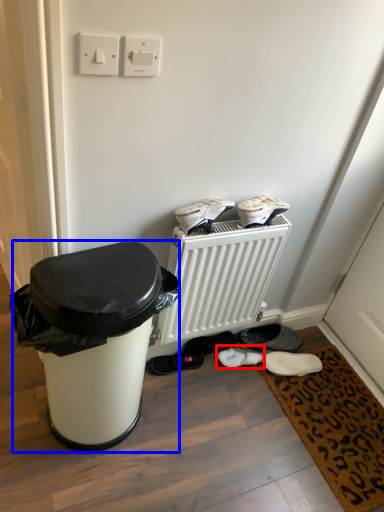
Question: Among these objects, which one is farthest to the camera, footwear (highlighted by a red box) or waste container (highlighted by a blue box)?

Choices:
 (A) footwear
 (B) waste container

Answer: (A)